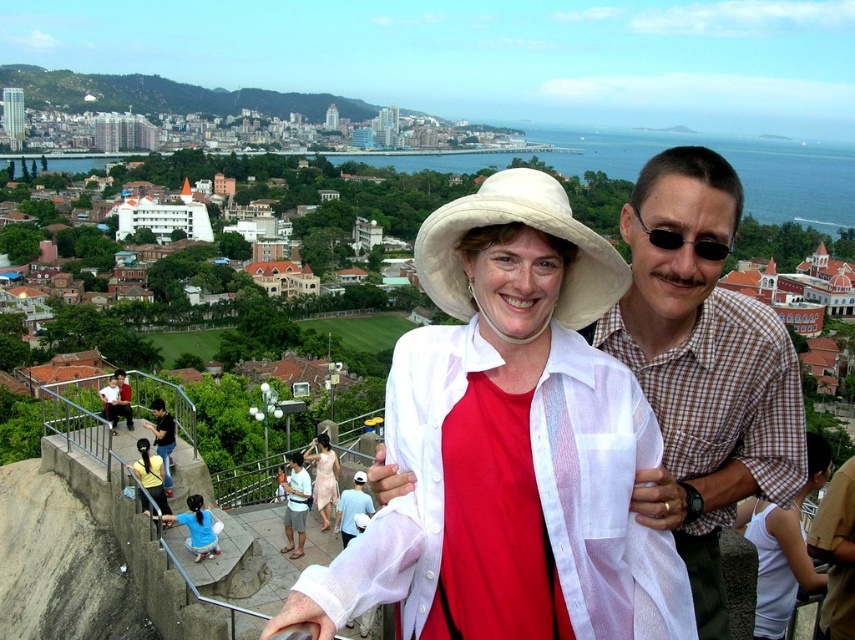
Question: Which of the following is the closest to the observer?

Choices:
 (A) (313, 454)
 (B) (351, 488)
 (C) (523, 246)

Answer: (C)

Question: Which is farther from the matte white blouse at center?

Choices:
 (A) dark blue jeans at lower left
 (B) brown checkered shirt at center

Answer: (B)

Question: Is matte white blouse at center further to camera compared to light blue denim shorts at lower center?

Choices:
 (A) yes
 (B) no

Answer: (A)

Question: Which of these objects is positioned closest to the brown checkered shirt at center?

Choices:
 (A) matte pink dress at center
 (B) white sheer blouse at center
 (C) matte white blouse at center

Answer: (B)

Question: Does brown checkered shirt at center appear on the right side of black plastic sunglasses at upper right?

Choices:
 (A) yes
 (B) no

Answer: (B)

Question: Observing the image, what is the correct spatial positioning of matte white blouse at center in reference to black plastic sunglasses at upper right?

Choices:
 (A) above
 (B) below

Answer: (B)